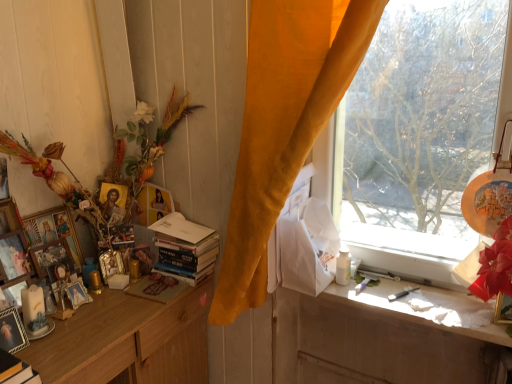
Question: From the image's perspective, is wooden picture frame at left, the ninth picture frame when ordered from right to left, on white glossy bottle at window?

Choices:
 (A) yes
 (B) no

Answer: (A)

Question: Can you confirm if wooden picture frame at left, the ninth picture frame when ordered from right to left, is positioned to the right of white glossy bottle at window?

Choices:
 (A) yes
 (B) no

Answer: (B)

Question: Would you say wooden picture frame at left, the ninth picture frame when ordered from right to left, is outside white glossy bottle at window?

Choices:
 (A) no
 (B) yes

Answer: (B)

Question: Can you confirm if wooden picture frame at left, the ninth picture frame when ordered from right to left, is bigger than white glossy bottle at window?

Choices:
 (A) yes
 (B) no

Answer: (B)

Question: Is wooden picture frame at left, marked as the 1th picture frame in a left-to-right arrangement, far from white glossy bottle at window?

Choices:
 (A) no
 (B) yes

Answer: (B)

Question: Considering the positions of smooth golden statue at center and hardcover books at center in the image, is smooth golden statue at center bigger or smaller than hardcover books at center?

Choices:
 (A) big
 (B) small

Answer: (B)

Question: Choose the correct answer: Is smooth golden statue at center inside hardcover books at center or outside it?

Choices:
 (A) inside
 (B) outside

Answer: (B)

Question: From the image's perspective, relative to hardcover books at center, is smooth golden statue at center above or below?

Choices:
 (A) below
 (B) above

Answer: (A)

Question: From their relative heights in the image, would you say smooth golden statue at center is taller or shorter than hardcover books at center?

Choices:
 (A) tall
 (B) short

Answer: (B)

Question: Is wooden picture frame at left, arranged as the fourth picture frame when viewed from the right, taller or shorter than wooden picture frame at left, the ninth picture frame when ordered from right to left?

Choices:
 (A) short
 (B) tall

Answer: (A)

Question: Considering the positions of point (57, 243) and point (5, 185), is point (57, 243) closer or farther from the camera than point (5, 185)?

Choices:
 (A) farther
 (B) closer

Answer: (A)

Question: Is wooden picture frame at left, arranged as the fourth picture frame when viewed from the right, inside the boundaries of wooden picture frame at left, marked as the 1th picture frame in a left-to-right arrangement, or outside?

Choices:
 (A) inside
 (B) outside

Answer: (B)

Question: In terms of width, does wooden picture frame at left, arranged as the fourth picture frame when viewed from the right, look wider or thinner when compared to wooden picture frame at left, the ninth picture frame when ordered from right to left?

Choices:
 (A) wide
 (B) thin

Answer: (A)

Question: Considering the positions of gold metallic picture frame at upper right, the 9th picture frame viewed from the left, and matte silver picture frame at lower left, marked as the 5th picture frame in a right-to-left arrangement, in the image, is gold metallic picture frame at upper right, the 9th picture frame viewed from the left, taller or shorter than matte silver picture frame at lower left, marked as the 5th picture frame in a right-to-left arrangement,?

Choices:
 (A) tall
 (B) short

Answer: (B)

Question: In terms of size, does gold metallic picture frame at upper right, placed as the first picture frame when sorted from right to left, appear bigger or smaller than matte silver picture frame at lower left, marked as the 5th picture frame in a right-to-left arrangement?

Choices:
 (A) big
 (B) small

Answer: (A)